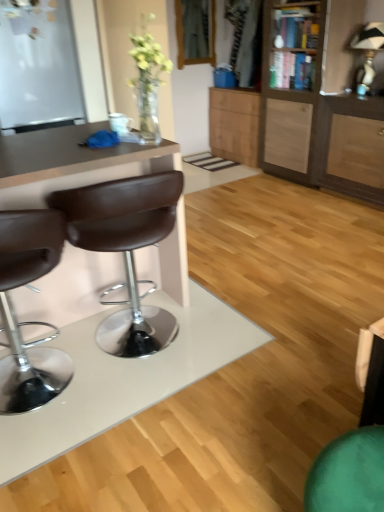
This screenshot has height=512, width=384. I want to click on free location in front of brown leather stool at left, placed as the 2th chair when sorted from right to left, so click(x=58, y=456).